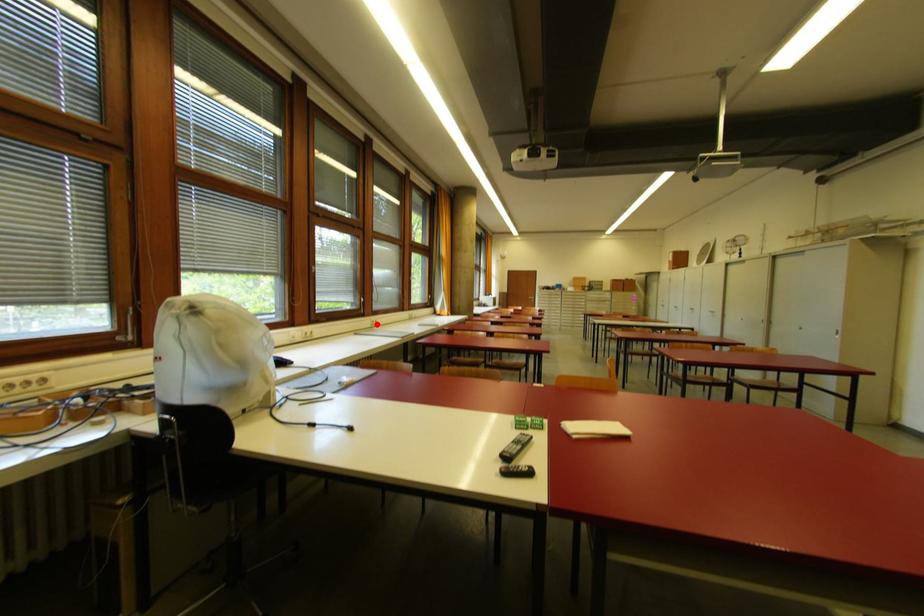
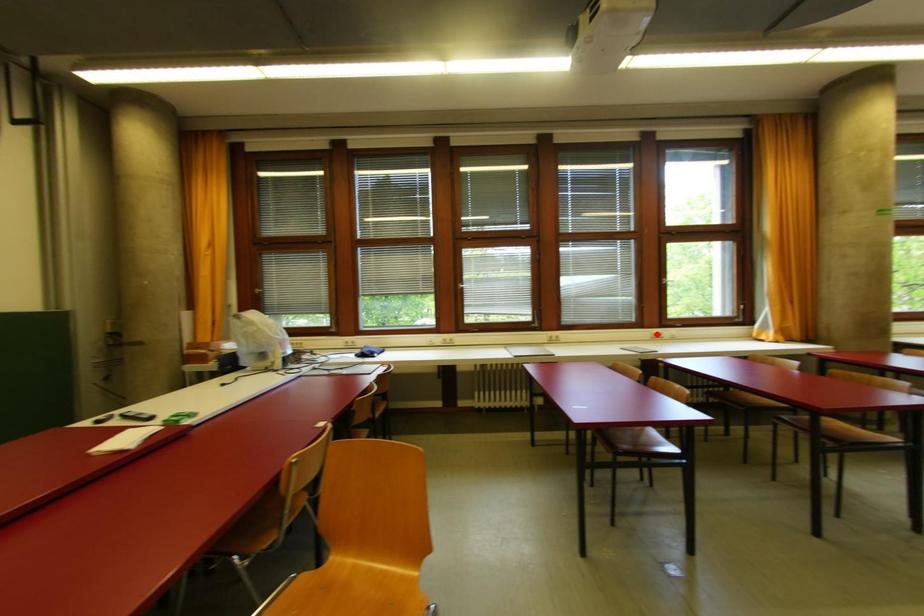
I am providing you with two images of the same scene from different viewpoints. A red point is marked on the first image and another point is marked on the second image. Is the red point in image1 aligned with the point shown in image2?

No